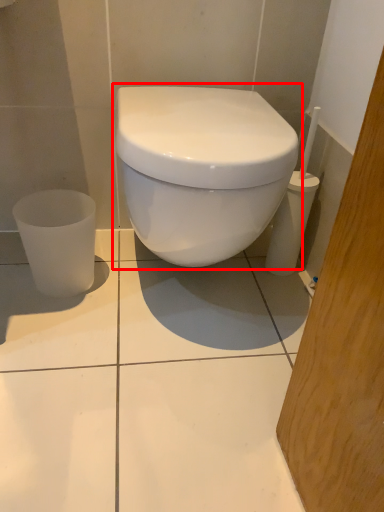
Question: From the image's perspective, what is the correct spatial positioning of toilet (annotated by the red box) in reference to porcelain?

Choices:
 (A) above
 (B) below

Answer: (A)